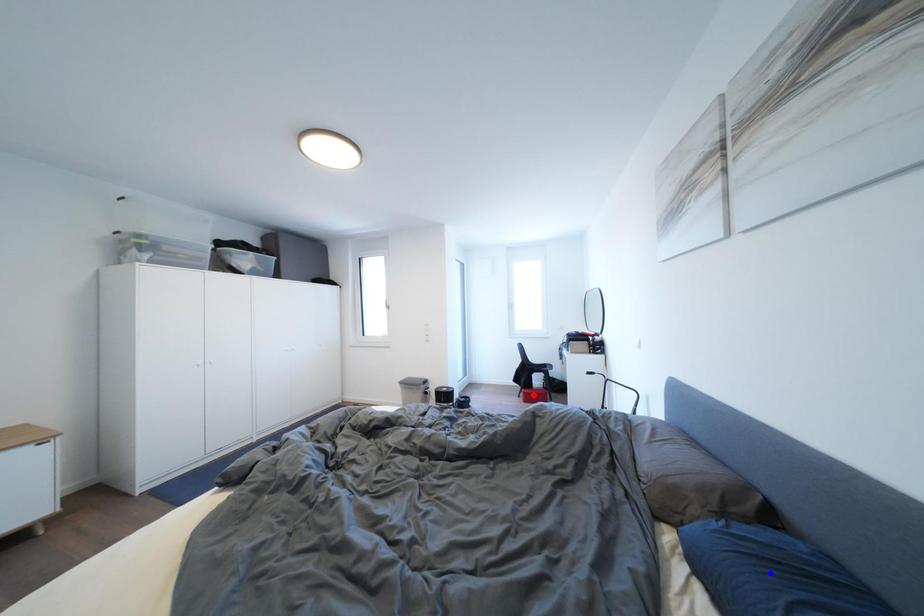
Question: Two points are marked on the image. Which point is closer to the camera?

Choices:
 (A) Blue point is closer.
 (B) Red point is closer.

Answer: (A)